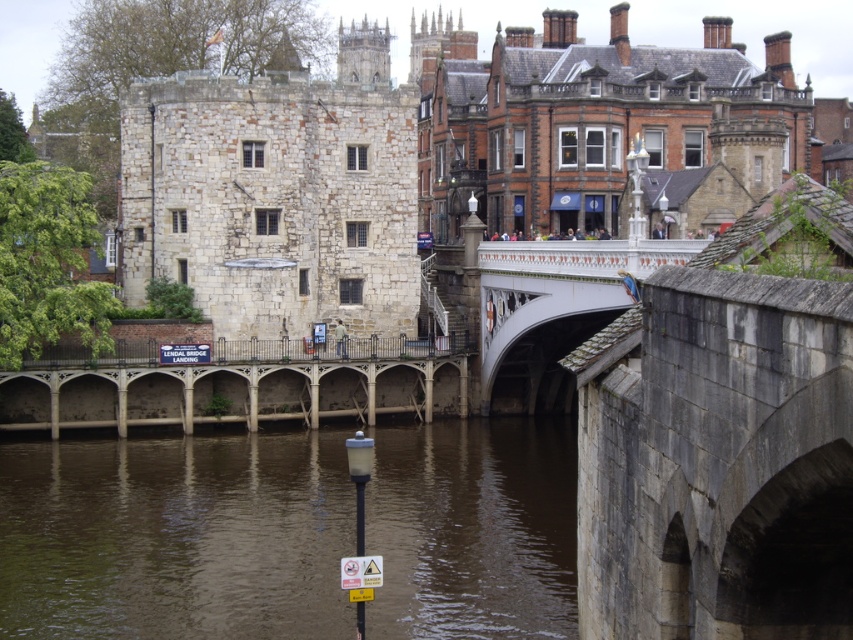
Question: Is stone castle at center bigger than stone arches at center?

Choices:
 (A) yes
 (B) no

Answer: (A)

Question: Does brown water at lower center appear on the left side of stone arches at center?

Choices:
 (A) no
 (B) yes

Answer: (A)

Question: Among these objects, which one is farthest from the camera?

Choices:
 (A) stone arches at center
 (B) brown water at lower center
 (C) white stone bridge at center
 (D) stone castle at center

Answer: (D)

Question: Among these objects, which one is farthest from the camera?

Choices:
 (A) stone castle at center
 (B) brown water at lower center
 (C) stone arches at center

Answer: (A)

Question: Which object is closer to the camera taking this photo?

Choices:
 (A) stone arches at center
 (B) white stone bridge at center
 (C) stone castle at center

Answer: (B)

Question: Can you confirm if stone castle at center is positioned to the left of stone arches at center?

Choices:
 (A) yes
 (B) no

Answer: (B)